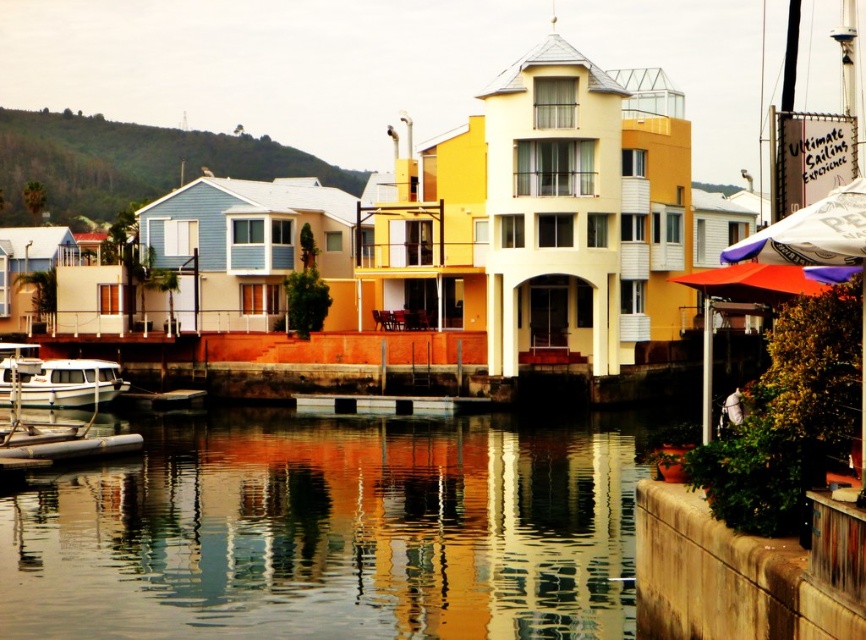
Question: Can you confirm if green grassy hillside at upper left is wider than white matte boat at lower left?

Choices:
 (A) no
 (B) yes

Answer: (B)

Question: Does white fabric umbrella at upper right have a smaller size compared to white matte boat at lower left?

Choices:
 (A) no
 (B) yes

Answer: (A)

Question: Based on their relative distances, which object is nearer to the white matte boat at lower left?

Choices:
 (A) white fabric umbrella at upper right
 (B) green grassy hillside at upper left

Answer: (A)

Question: Which of the following is the farthest from the observer?

Choices:
 (A) reflective glass water at lower center
 (B) white fabric umbrella at upper right

Answer: (A)

Question: Does reflective glass water at lower center have a greater width compared to green grassy hillside at upper left?

Choices:
 (A) yes
 (B) no

Answer: (B)

Question: Which object is the farthest from the white fabric umbrella at upper right?

Choices:
 (A) reflective glass water at lower center
 (B) white matte boat at lower left

Answer: (B)